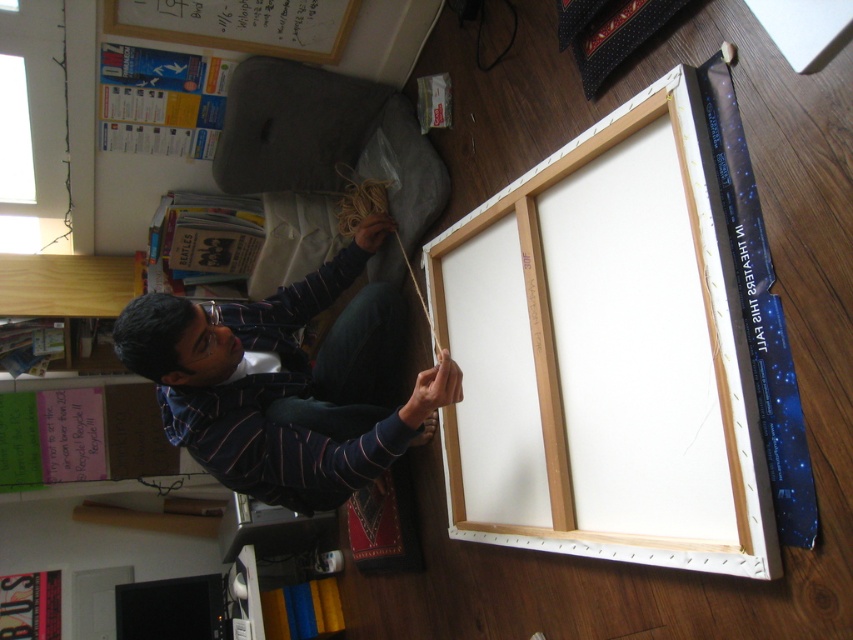
Can you confirm if white matte canvas at center is positioned below striped shirt at lower left?

Yes.

Is white matte canvas at center to the left of striped shirt at lower left from the viewer's perspective?

No, white matte canvas at center is not to the left of striped shirt at lower left.

What are the coordinates of `white matte canvas at center` in the screenshot? It's located at (605, 355).